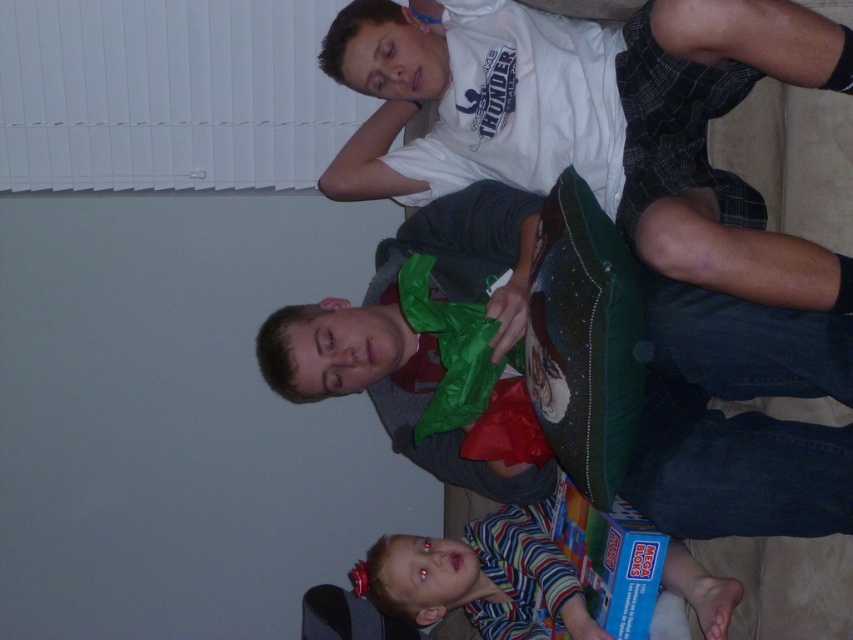
You are a photographer trying to capture a clear shot of the matte green pillow at center without the white cotton shirt at upper center blocking it. What adjustment should you make to your camera position?

Move the camera position backward to create more distance between the white cotton shirt at upper center and the matte green pillow at center so the shirt no longer blocks the pillow.

You are organizing a small party and need to place decorations. You have a white cotton shirt at upper center and a blue cardboard box at lower center. Which object should you move to access the other?

The white cotton shirt at upper center is positioned over the blue cardboard box at lower center. To access the blue cardboard box at lower center, you should move the white cotton shirt at upper center.

In the scene shown: You are trying to determine the spatial relationship between the white cotton shirt at upper center and the matte green pillow at center. Which object is shorter in height?

The white cotton shirt at upper center is shorter in height compared to the matte green pillow at center.